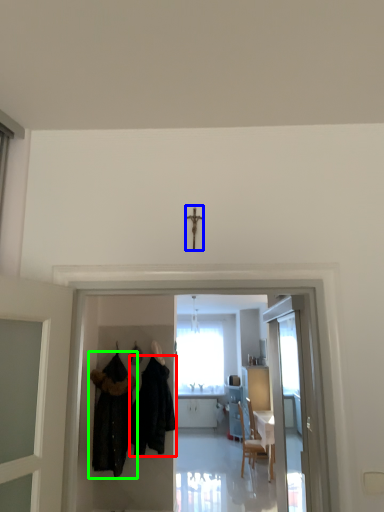
Question: Based on their relative distances, which object is nearer to fancy dress (highlighted by a red box)? Choose from crucifix (highlighted by a blue box) and fancy dress (highlighted by a green box).

Choices:
 (A) crucifix
 (B) fancy dress

Answer: (B)